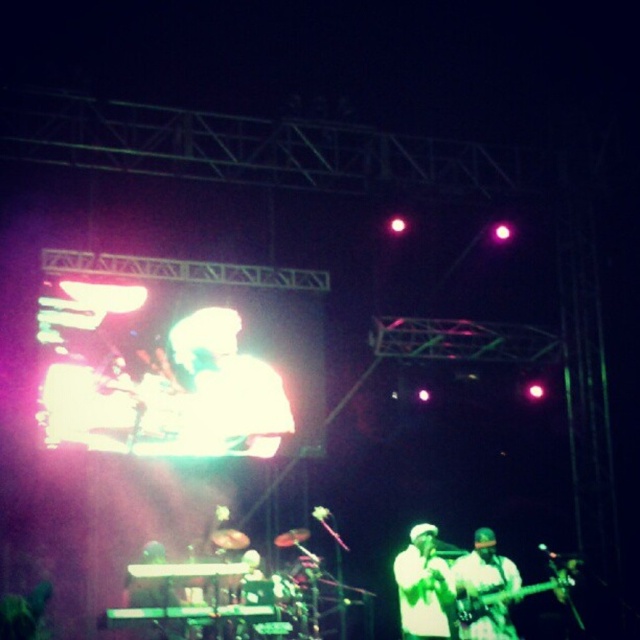
You are a photographer trying to capture a closeup of the two points on the stage. Which point, point (476, 605) or point (509, 589), is closer to your camera lens?

Point (476, 605) is closer to the camera lens than point (509, 589).

You are a photographer trying to capture a closeup shot of both the white matte shirt at center and the white matte guitar at lower right in the scene. Given their distance apart, can you fit both into your camera frame which has a maximum field of view of 18 inches?

The white matte shirt at center and white matte guitar at lower right are 18.20 inches apart, which exceeds the camera frame of 18 inches, so you cannot fit both into the frame.

You are a photographer at the back of the venue trying to capture a clear photo of the two musicians. There are two points marked on your camera screen. The first point is at coordinates point (442,580) and the second point is at coordinates point (490,600). Which point should you focus on to ensure the musician closer to the front is in focus?

Point (490,600) should be focused on because it corresponds to the musician closer to the front, as point (442,580) is behind point (490,600).